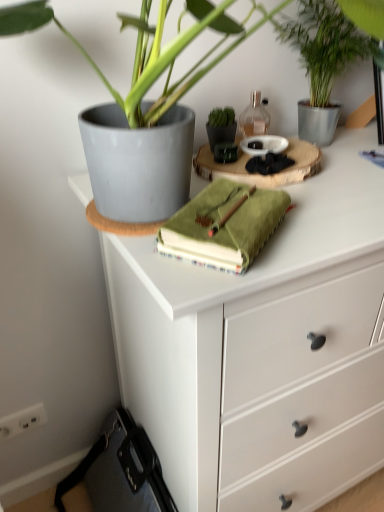
What are the coordinates of `free point to the right of green matte flowerpot at center` in the screenshot? It's located at (334, 169).